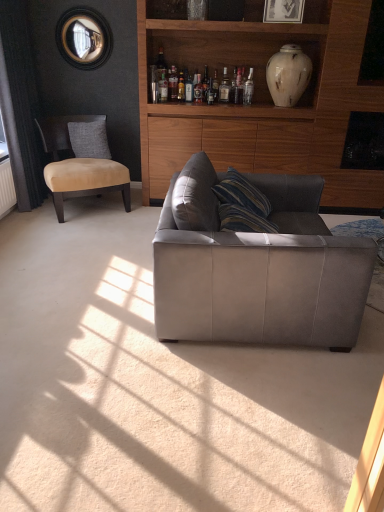
I want to click on clear glass bottle at upper center, placed as the 1th bottle when sorted from left to right, so click(x=153, y=84).

Describe the element at coordinates (153, 84) in the screenshot. I see `clear glass bottle at upper center, placed as the 1th bottle when sorted from left to right` at that location.

What is the approximate height of suede gray couch at center?

→ It is 32.38 inches.

What is the approximate width of suede gray couch at center?

suede gray couch at center is 1.13 meters wide.

The height and width of the screenshot is (512, 384). Identify the location of clear glass bottle at upper center, placed as the first bottle when sorted from right to left. (248, 88).

In order to face clear glass bottle at upper center, placed as the first bottle when sorted from right to left, should I rotate leftwards or rightwards?

To face it directly, rotate right by 7.611 degrees.

The image size is (384, 512). Find the location of `suede beige chair at left`. suede beige chair at left is located at coordinates (81, 160).

Is clear glass bottle at upper center, the 5th bottle in the right-to-left sequence, to the left of translucent glass bottle at upper center, which appears as the fourth bottle when viewed from the left, from the viewer's perspective?

Indeed, clear glass bottle at upper center, the 5th bottle in the right-to-left sequence, is positioned on the left side of translucent glass bottle at upper center, which appears as the fourth bottle when viewed from the left.

From a real-world perspective, between clear glass bottle at upper center, the 5th bottle in the right-to-left sequence, and translucent glass bottle at upper center, the second bottle positioned from the right, who is vertically lower?

In real-world perspective, translucent glass bottle at upper center, the second bottle positioned from the right, is lower.

Who is shorter, clear glass bottle at upper center, placed as the 1th bottle when sorted from left to right, or translucent glass bottle at upper center, which appears as the fourth bottle when viewed from the left?

clear glass bottle at upper center, placed as the 1th bottle when sorted from left to right.

Can you confirm if clear glass bottle at upper center, placed as the 1th bottle when sorted from left to right, is bigger than translucent glass bottle at upper center, the second bottle positioned from the right?

Incorrect, clear glass bottle at upper center, placed as the 1th bottle when sorted from left to right, is not larger than translucent glass bottle at upper center, the second bottle positioned from the right.

Who is taller, suede beige chair at left or clear glass bottle at upper center, the 5th bottle from the left?

Standing taller between the two is suede beige chair at left.

Could you measure the distance between suede beige chair at left and clear glass bottle at upper center, placed as the first bottle when sorted from right to left?

suede beige chair at left and clear glass bottle at upper center, placed as the first bottle when sorted from right to left, are 5.32 feet apart.

Which is correct: suede beige chair at left is inside clear glass bottle at upper center, placed as the first bottle when sorted from right to left, or outside of it?

The correct answer is: outside.

Does point (151, 101) lie behind point (348, 71)?

Yes, point (151, 101) is behind point (348, 71).

Is clear glass bottle at upper center, placed as the 1th bottle when sorted from left to right, surrounding wooden cabinet at upper center?

Definitely not — wooden cabinet at upper center is not inside clear glass bottle at upper center, placed as the 1th bottle when sorted from left to right.

Is clear glass bottle at upper center, the 5th bottle in the right-to-left sequence, not close to wooden cabinet at upper center?

Yes, clear glass bottle at upper center, the 5th bottle in the right-to-left sequence, is far from wooden cabinet at upper center.

Can you confirm if clear glass bottle at upper center, the 5th bottle in the right-to-left sequence, is wider than wooden cabinet at upper center?

Incorrect, the width of clear glass bottle at upper center, the 5th bottle in the right-to-left sequence, does not surpass that of wooden cabinet at upper center.

Considering the positions of objects translucent glass bottle at upper center, which appears as the 2th bottle when viewed from the left, and clear glass bottle at upper center, placed as the 1th bottle when sorted from left to right, in the image provided, who is more to the right, translucent glass bottle at upper center, which appears as the 2th bottle when viewed from the left, or clear glass bottle at upper center, placed as the 1th bottle when sorted from left to right,?

translucent glass bottle at upper center, which appears as the 2th bottle when viewed from the left.

Can you see translucent glass bottle at upper center, which appears as the 2th bottle when viewed from the left, touching clear glass bottle at upper center, the 5th bottle in the right-to-left sequence?

Yes, translucent glass bottle at upper center, which appears as the 2th bottle when viewed from the left, is beside clear glass bottle at upper center, the 5th bottle in the right-to-left sequence.

Is translucent glass bottle at upper center, which appears as the 2th bottle when viewed from the left, oriented away from clear glass bottle at upper center, the 5th bottle in the right-to-left sequence?

No, translucent glass bottle at upper center, which appears as the 2th bottle when viewed from the left,'s orientation is not away from clear glass bottle at upper center, the 5th bottle in the right-to-left sequence.

Between translucent glass bottle at upper center, which appears as the 2th bottle when viewed from the left, and clear glass bottle at upper center, the 5th bottle in the right-to-left sequence, which one has more height?

clear glass bottle at upper center, the 5th bottle in the right-to-left sequence, is taller.

Is suede gray couch at center turned away from clear glass bottle at upper center, the 5th bottle from the left?

No, suede gray couch at center is not facing away from clear glass bottle at upper center, the 5th bottle from the left.

In order to click on studio couch that is under the clear glass bottle at upper center, the 5th bottle from the left (from a real-world perspective) in this screenshot , I will do `click(257, 268)`.

From the image's perspective, is suede gray couch at center located above or below clear glass bottle at upper center, placed as the first bottle when sorted from right to left?

suede gray couch at center is situated lower than clear glass bottle at upper center, placed as the first bottle when sorted from right to left, in the image.

From the image's perspective, relative to clear glass bottle at upper center, the 5th bottle from the left, is translucent glass bottle at upper center, which is the third bottle from right to left, above or below?

Clearly, from the image's perspective, translucent glass bottle at upper center, which is the third bottle from right to left, is above clear glass bottle at upper center, the 5th bottle from the left.

Looking at their sizes, would you say translucent glass bottle at upper center, which is the third bottle from right to left, is wider or thinner than clear glass bottle at upper center, placed as the first bottle when sorted from right to left?

In the image, translucent glass bottle at upper center, which is the third bottle from right to left, appears to be wider than clear glass bottle at upper center, placed as the first bottle when sorted from right to left.

How distant is translucent glass bottle at upper center, which is the third bottle from right to left, from clear glass bottle at upper center, the 5th bottle from the left?

translucent glass bottle at upper center, which is the third bottle from right to left, and clear glass bottle at upper center, the 5th bottle from the left, are 26.55 inches apart from each other.

Between point (168, 87) and point (245, 84), which one is positioned in front?

The point (168, 87) is closer to the camera.

Consider the image. In terms of size, does suede beige chair at left appear bigger or smaller than suede gray couch at center?

suede beige chair at left is smaller than suede gray couch at center.

Is suede beige chair at left oriented towards suede gray couch at center?

Yes, suede beige chair at left faces towards suede gray couch at center.

Where is `the 2nd bottle above the clear glass bottle at upper center, placed as the 1th bottle when sorted from left to right (from the image's perspective)`? The width and height of the screenshot is (384, 512). the 2nd bottle above the clear glass bottle at upper center, placed as the 1th bottle when sorted from left to right (from the image's perspective) is located at coordinates (224, 87).

Starting from the suede beige chair at left, which bottle is the 3rd one behind? Please provide its 2D coordinates.

[(248, 88)]

Which object lies further to the anchor point wooden cabinet at upper center, white marble vase at upper right or clear glass bottle at upper center, the 5th bottle from the left?

clear glass bottle at upper center, the 5th bottle from the left, lies further to wooden cabinet at upper center than the other object.

From the image, which object appears to be farther from suede gray couch at center, suede beige chair at left or white marble vase at upper right?

The object further to suede gray couch at center is white marble vase at upper right.

Based on the photo, looking at the image, which one is located closer to clear glass bottle at upper center, placed as the first bottle when sorted from right to left, translucent glass bottle at upper center, which appears as the fourth bottle when viewed from the left, or translucent glass bottle at upper center, marked as the fourth bottle in a right-to-left arrangement?

translucent glass bottle at upper center, which appears as the fourth bottle when viewed from the left, is positioned closer to the anchor clear glass bottle at upper center, placed as the first bottle when sorted from right to left.

Considering their positions, is white marble vase at upper right positioned further to suede beige chair at left than translucent glass bottle at upper center, placed as the 3th bottle when sorted from left to right?

white marble vase at upper right is further to suede beige chair at left.

Based on their spatial positions, is suede beige chair at left or suede gray couch at center closer to wooden cabinet at upper center?

The object closer to wooden cabinet at upper center is suede beige chair at left.

When comparing their distances from suede gray couch at center, does translucent glass bottle at upper center, the second bottle positioned from the right, or white marble vase at upper right seem further?

translucent glass bottle at upper center, the second bottle positioned from the right.

Based on their spatial positions, is suede beige chair at left or wooden cabinet at upper center closer to translucent glass bottle at upper center, which appears as the fourth bottle when viewed from the left?

wooden cabinet at upper center is positioned closer to the anchor translucent glass bottle at upper center, which appears as the fourth bottle when viewed from the left.

When comparing their distances from clear glass bottle at upper center, the 5th bottle from the left, does white marble vase at upper right or suede beige chair at left seem further?

Based on the image, suede beige chair at left appears to be further to clear glass bottle at upper center, the 5th bottle from the left.

At what (x,y) coordinates should I click in order to perform the action: click on pillow between suede beige chair at left and translucent glass bottle at upper center, marked as the fourth bottle in a right-to-left arrangement, from left to right. Please return your answer as a coordinate pair (x, y). The height and width of the screenshot is (512, 384). Looking at the image, I should click on (89, 138).

Where is `bottle situated between gray fabric pillow at left and translucent glass bottle at upper center, which appears as the 2th bottle when viewed from the left, from left to right`? bottle situated between gray fabric pillow at left and translucent glass bottle at upper center, which appears as the 2th bottle when viewed from the left, from left to right is located at coordinates (153, 84).

Where is `bottle situated between clear glass bottle at upper center, the 5th bottle in the right-to-left sequence, and translucent glass bottle at upper center, which is the third bottle from right to left, from left to right`? This screenshot has height=512, width=384. bottle situated between clear glass bottle at upper center, the 5th bottle in the right-to-left sequence, and translucent glass bottle at upper center, which is the third bottle from right to left, from left to right is located at coordinates (163, 86).

Where is `chair between suede gray couch at center and gray fabric pillow at left from front to back`? The width and height of the screenshot is (384, 512). chair between suede gray couch at center and gray fabric pillow at left from front to back is located at coordinates (81, 160).